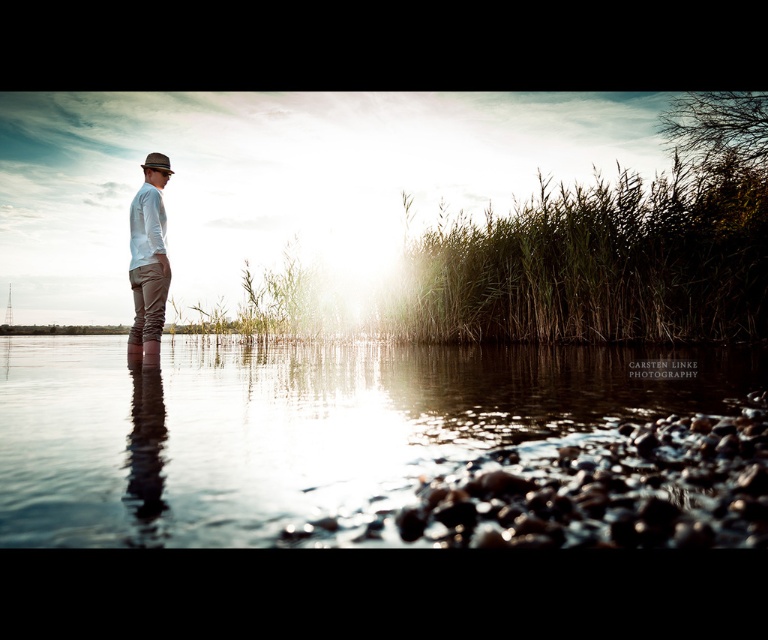
Is matte white shirt at center closer to the viewer compared to matte brown fedora at left?

That is True.

Can you confirm if matte white shirt at center is positioned below matte brown fedora at left?

Yes.

Is point (136, 276) positioned after point (171, 172)?

No, it is not.

Where is `matte white shirt at center`? Image resolution: width=768 pixels, height=640 pixels. matte white shirt at center is located at coordinates (147, 257).

Is clear water at center wider than matte white shirt at center?

Yes, clear water at center is wider than matte white shirt at center.

Looking at this image, between clear water at center and matte white shirt at center, which one appears on the left side from the viewer's perspective?

From the viewer's perspective, matte white shirt at center appears more on the left side.

Consider the image. Who is more forward, (x=167, y=364) or (x=134, y=342)?

Point (x=167, y=364) is more forward.

Locate an element on the screen. This screenshot has width=768, height=640. clear water at center is located at coordinates (363, 444).

Does point (399, 355) lie behind point (154, 157)?

Yes, point (399, 355) is farther from viewer.

Image resolution: width=768 pixels, height=640 pixels. I want to click on clear water at center, so click(363, 444).